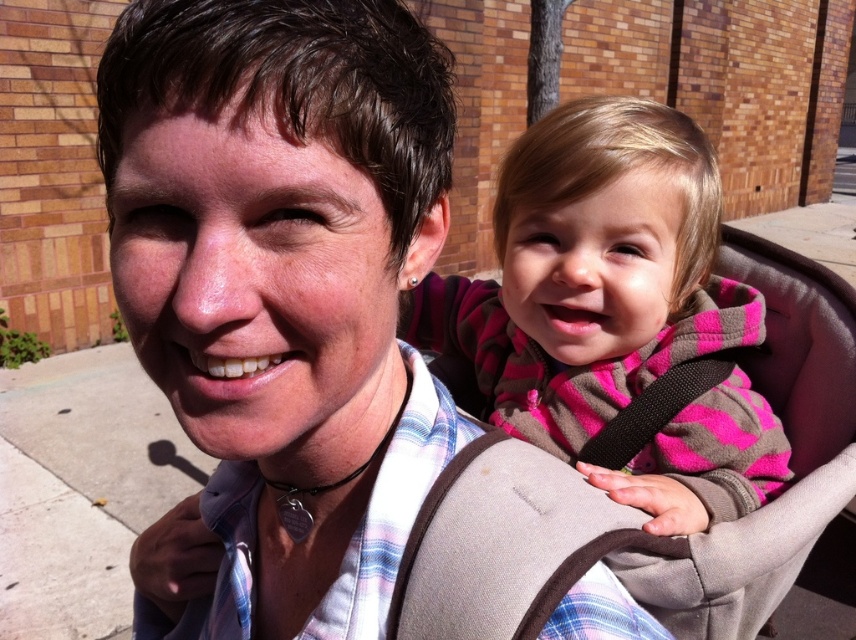
Does pink fleece jacket at upper center have a smaller size compared to pink fleece jacket at center?

No, pink fleece jacket at upper center is not smaller than pink fleece jacket at center.

In order to click on pink fleece jacket at upper center in this screenshot , I will do `click(592, 272)`.

Who is more forward, (621, 232) or (437, 340)?

Positioned in front is point (621, 232).

Where is `pink fleece jacket at upper center`? The width and height of the screenshot is (856, 640). pink fleece jacket at upper center is located at coordinates (592, 272).